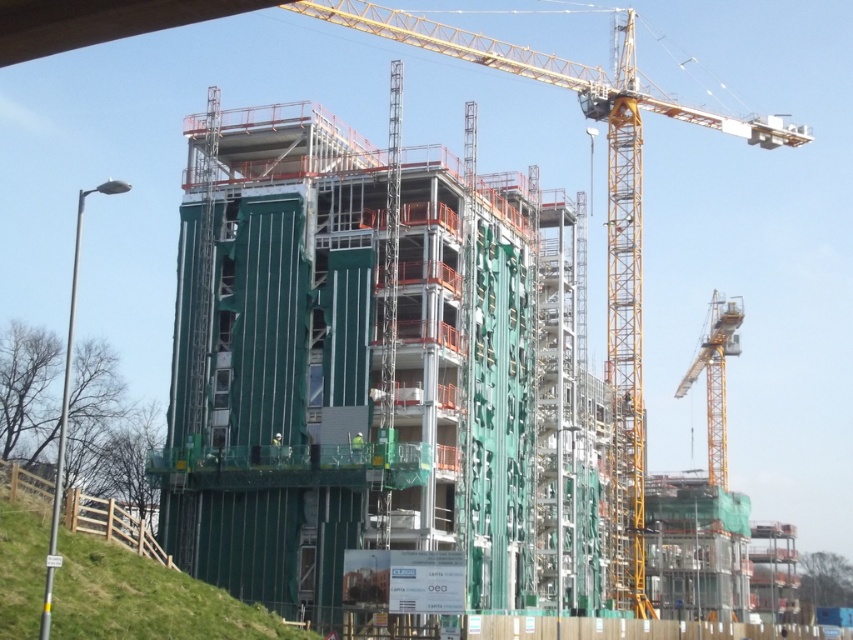
Question: Observing the image, what is the correct spatial positioning of yellow metallic crane at upper center in reference to yellow metallic crane at right?

Choices:
 (A) left
 (B) right

Answer: (A)

Question: Which point is closer to the camera?

Choices:
 (A) yellow metallic crane at upper center
 (B) green grass at lower left
 (C) yellow metallic crane at right

Answer: (B)

Question: Is yellow metallic crane at upper center positioned at the back of yellow metallic crane at right?

Choices:
 (A) no
 (B) yes

Answer: (A)

Question: Which of the following is the farthest from the observer?

Choices:
 (A) yellow metallic crane at right
 (B) green grass at lower left
 (C) yellow metallic crane at upper center

Answer: (A)

Question: Can you confirm if yellow metallic crane at upper center is positioned below yellow metallic crane at right?

Choices:
 (A) yes
 (B) no

Answer: (B)

Question: Which of the following is the closest to the observer?

Choices:
 (A) green grass at lower left
 (B) yellow metallic crane at upper center
 (C) yellow metallic crane at right

Answer: (A)